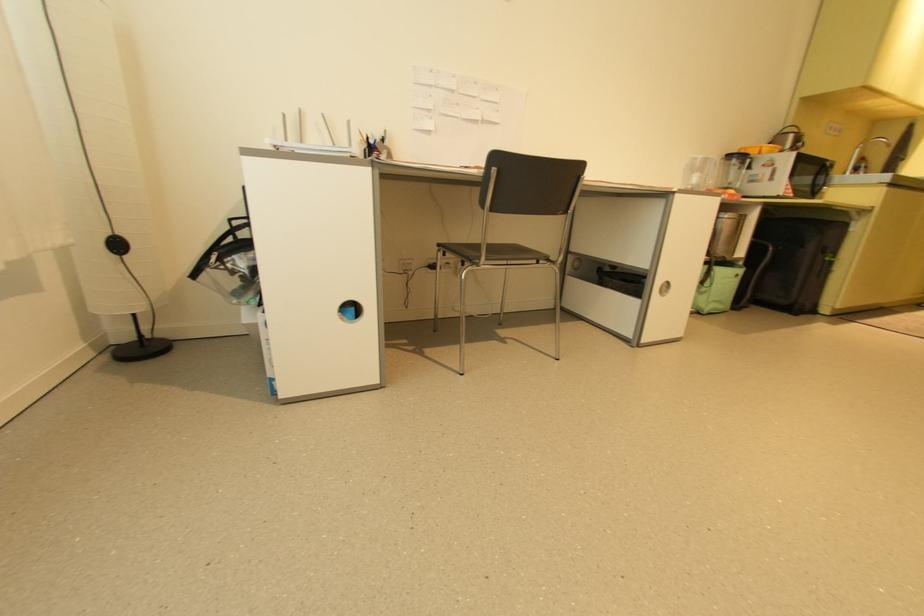
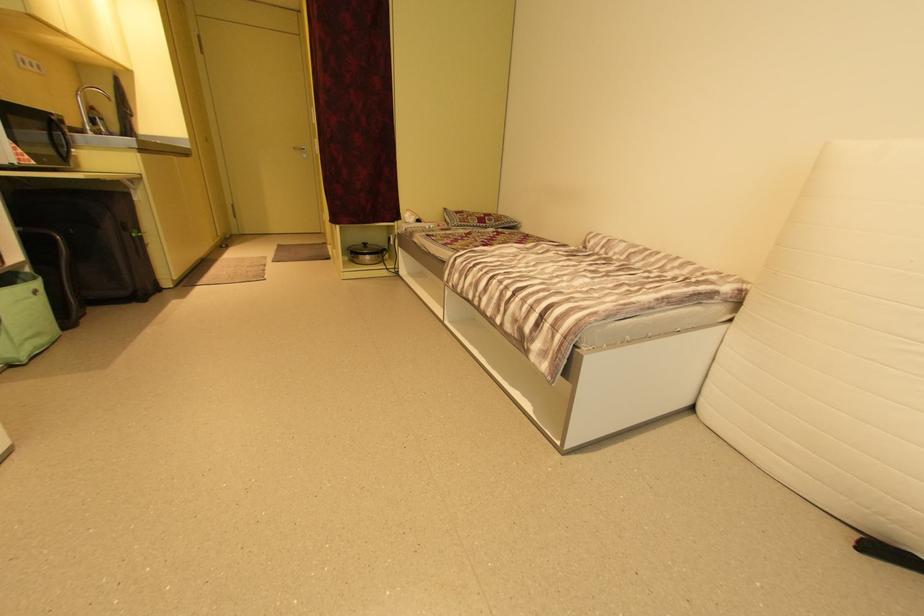
The images are taken continuously from a first-person perspective. In which direction is your viewpoint rotating?

The rotation direction of the camera is right-down.